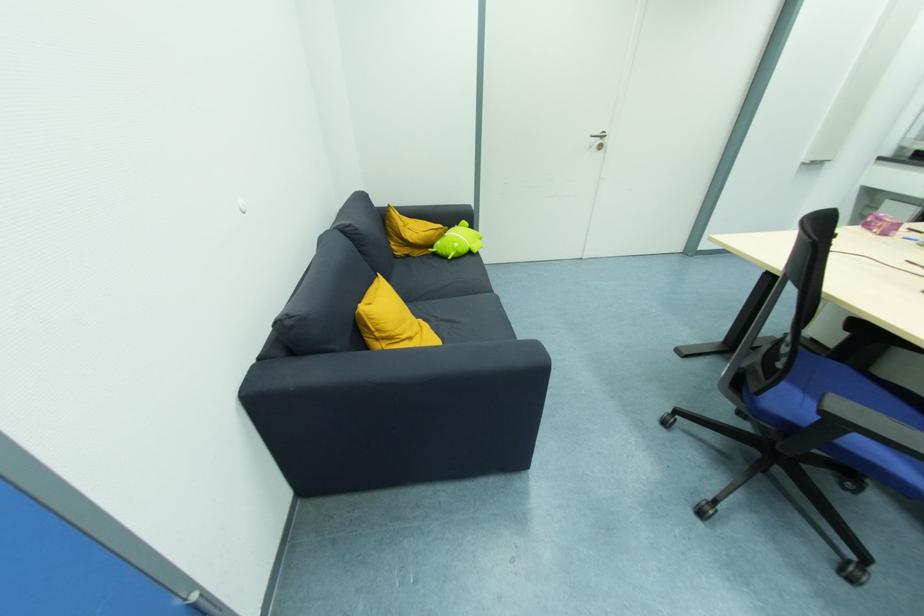
Locate an element on the screen. chair back top rail is located at coordinates (820, 225).